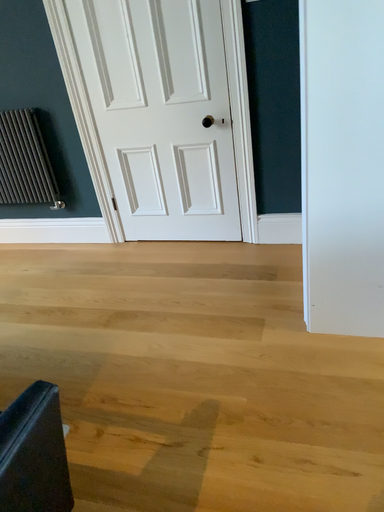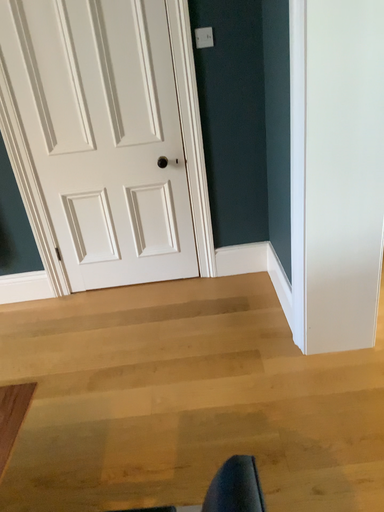
Question: Which way did the camera rotate in the video?

Choices:
 (A) rotated downward
 (B) rotated upward

Answer: (B)